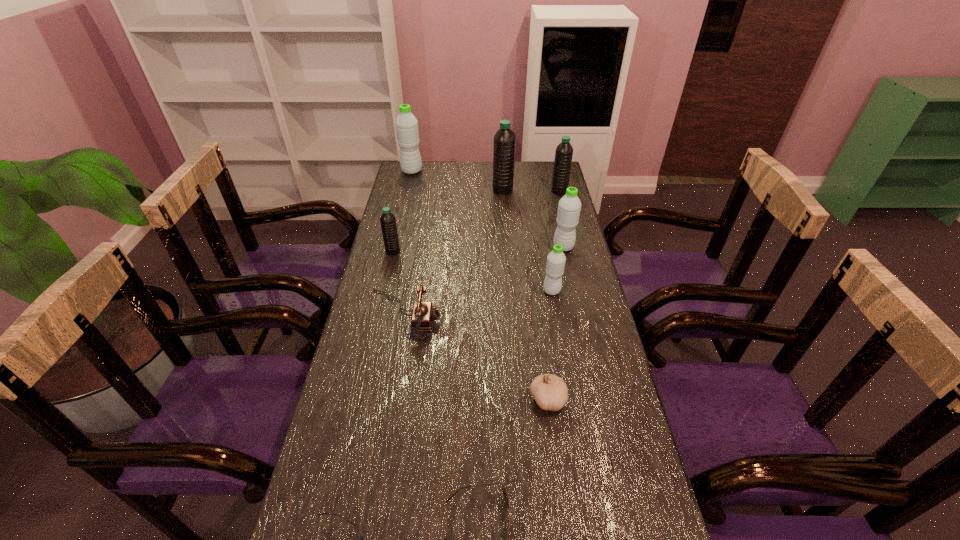
The width and height of the screenshot is (960, 540). I want to click on free space between the telephone and the garlic, so click(475, 357).

The height and width of the screenshot is (540, 960). What are the coordinates of `free space between the nearest water bottle and the second black water bottle from left to right` in the screenshot? It's located at (527, 240).

You are a GUI agent. You are given a task and a screenshot of the screen. Output one action in this format:
    pyautogui.click(x=<x>, y=<y>)
    Task: Click on the free area in between the telephone and the second nearest green water bottle
    Image resolution: width=960 pixels, height=540 pixels.
    Given the screenshot: What is the action you would take?
    coord(483,281)

What are the coordinates of `object that stands as the second closest to the farthest water bottle` in the screenshot? It's located at (387, 220).

The image size is (960, 540). What are the coordinates of `the fifth closest object to the telephone` in the screenshot? It's located at (569, 206).

Identify which water bottle is located as the nearest to the farthest water bottle. Please provide its 2D coordinates. Your answer should be formatted as a tuple, i.e. [(x, y)], where the tuple contains the x and y coordinates of a point satisfying the conditions above.

[(504, 140)]

Identify the location of water bottle that stands as the third closest to the telephone. (569, 206).

Locate which green water bottle is the closest to the nearest water bottle. Please provide its 2D coordinates. Your answer should be formatted as a tuple, i.e. [(x, y)], where the tuple contains the x and y coordinates of a point satisfying the conditions above.

[(569, 206)]

Choose which green water bottle is the second nearest neighbor to the garlic. Please provide its 2D coordinates. Your answer should be formatted as a tuple, i.e. [(x, y)], where the tuple contains the x and y coordinates of a point satisfying the conditions above.

[(569, 206)]

Locate an element on the screen. black water bottle that can be found as the closest to the second smallest black water bottle is located at coordinates (504, 140).